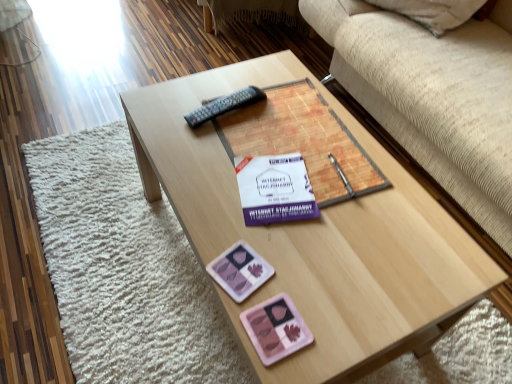
Question: Does black plastic remote at center have a lesser height compared to pink plastic at lower center, which is the second currency in bottom-to-top order?

Choices:
 (A) no
 (B) yes

Answer: (B)

Question: Is black plastic remote at center not inside pink plastic at lower center, which appears as the 1th currency when viewed from the top?

Choices:
 (A) no
 (B) yes

Answer: (B)

Question: Is black plastic remote at center oriented towards pink plastic at lower center, which is the second currency in bottom-to-top order?

Choices:
 (A) no
 (B) yes

Answer: (A)

Question: Is pink plastic at lower center, which appears as the 1th currency when viewed from the top, a part of black plastic remote at center?

Choices:
 (A) no
 (B) yes

Answer: (A)

Question: Considering the relative positions of black plastic remote at center and pink plastic at lower center, which is the second currency in bottom-to-top order, in the image provided, is black plastic remote at center to the left of pink plastic at lower center, which is the second currency in bottom-to-top order, from the viewer's perspective?

Choices:
 (A) yes
 (B) no

Answer: (A)

Question: In terms of width, does black plastic remote at center look wider or thinner when compared to white paper at center?

Choices:
 (A) thin
 (B) wide

Answer: (B)

Question: Do you think black plastic remote at center is within white paper at center, or outside of it?

Choices:
 (A) inside
 (B) outside

Answer: (B)

Question: Based on their sizes in the image, would you say black plastic remote at center is bigger or smaller than white paper at center?

Choices:
 (A) small
 (B) big

Answer: (A)

Question: Is black plastic remote at center to the left or to the right of white paper at center in the image?

Choices:
 (A) left
 (B) right

Answer: (A)

Question: From the image's perspective, is pink plastic at lower center, which appears as the 1th currency when viewed from the top, positioned above or below pink matte palette at center, which ranks as the second currency in top-to-bottom order?

Choices:
 (A) below
 (B) above

Answer: (B)

Question: From a real-world perspective, is pink plastic at lower center, which is the second currency in bottom-to-top order, physically located above or below pink matte palette at center, which ranks as the second currency in top-to-bottom order?

Choices:
 (A) above
 (B) below

Answer: (B)

Question: Is pink plastic at lower center, which appears as the 1th currency when viewed from the top, in front of or behind pink matte palette at center, which is the first currency from bottom to top, in the image?

Choices:
 (A) front
 (B) behind

Answer: (B)

Question: Considering the positions of point (221, 266) and point (282, 334), is point (221, 266) closer or farther from the camera than point (282, 334)?

Choices:
 (A) farther
 (B) closer

Answer: (A)

Question: From a real-world perspective, is pink plastic at lower center, which is the second currency in bottom-to-top order, physically located above or below matte paper book at center?

Choices:
 (A) below
 (B) above

Answer: (A)

Question: In terms of height, does pink plastic at lower center, which is the second currency in bottom-to-top order, look taller or shorter compared to matte paper book at center?

Choices:
 (A) tall
 (B) short

Answer: (B)